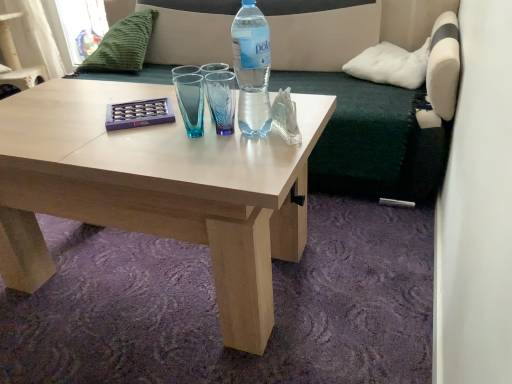
Question: Does light wood coffee table at center have a larger size compared to white fabric armchair at upper left?

Choices:
 (A) yes
 (B) no

Answer: (B)

Question: Is light wood coffee table at center positioned far away from white fabric armchair at upper left?

Choices:
 (A) no
 (B) yes

Answer: (B)

Question: Are light wood coffee table at center and white fabric armchair at upper left beside each other?

Choices:
 (A) yes
 (B) no

Answer: (B)

Question: Is light wood coffee table at center positioned with its back to white fabric armchair at upper left?

Choices:
 (A) yes
 (B) no

Answer: (B)

Question: Is light wood coffee table at center oriented towards white fabric armchair at upper left?

Choices:
 (A) no
 (B) yes

Answer: (A)

Question: Considering the relative positions of light wood coffee table at center and white fabric armchair at upper left in the image provided, is light wood coffee table at center to the left of white fabric armchair at upper left from the viewer's perspective?

Choices:
 (A) no
 (B) yes

Answer: (A)

Question: Does dark green fabric couch at upper center have a lesser width compared to white fabric armchair at upper left?

Choices:
 (A) no
 (B) yes

Answer: (A)

Question: Does dark green fabric couch at upper center appear on the right side of white fabric armchair at upper left?

Choices:
 (A) yes
 (B) no

Answer: (A)

Question: Can you confirm if dark green fabric couch at upper center is shorter than white fabric armchair at upper left?

Choices:
 (A) no
 (B) yes

Answer: (A)

Question: Is dark green fabric couch at upper center located outside white fabric armchair at upper left?

Choices:
 (A) yes
 (B) no

Answer: (A)

Question: From the image's perspective, is dark green fabric couch at upper center above white fabric armchair at upper left?

Choices:
 (A) yes
 (B) no

Answer: (B)

Question: Is dark green fabric couch at upper center looking in the opposite direction of white fabric armchair at upper left?

Choices:
 (A) no
 (B) yes

Answer: (A)

Question: Can you confirm if green knitted pillow at upper left, acting as the second pillow starting from the right, is smaller than translucent plastic bottle at center?

Choices:
 (A) no
 (B) yes

Answer: (A)